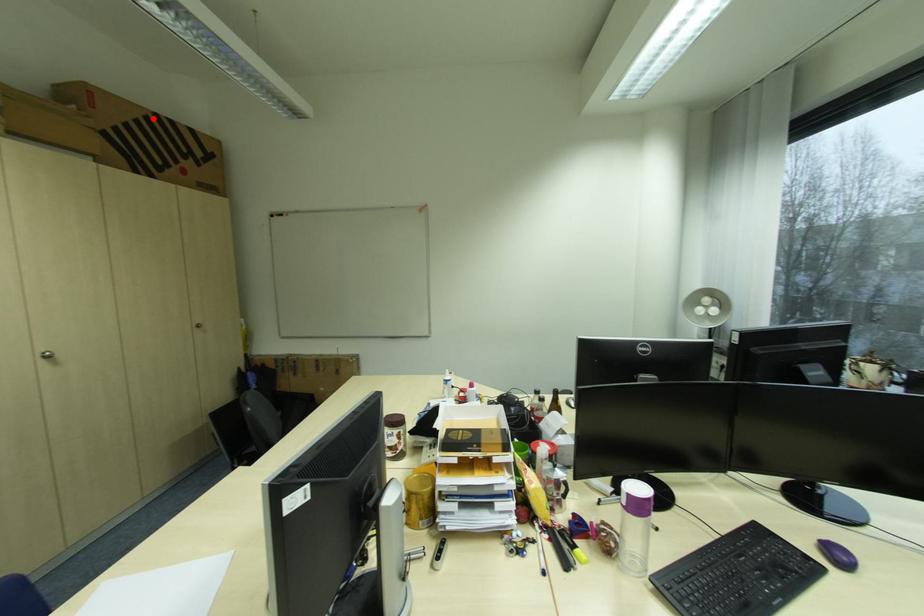
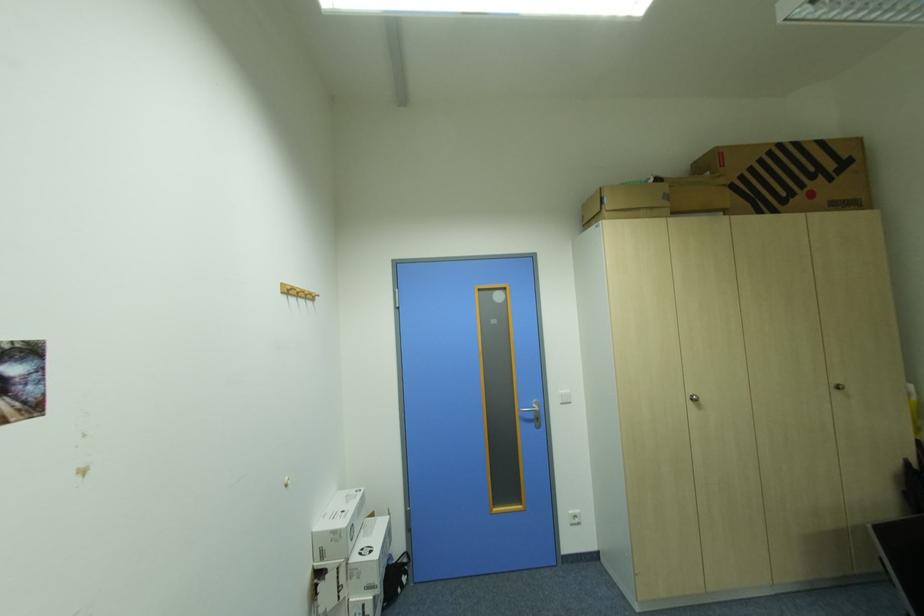
Where in the second image is the point corresponding to the highlighted location from the first image?

(777, 153)